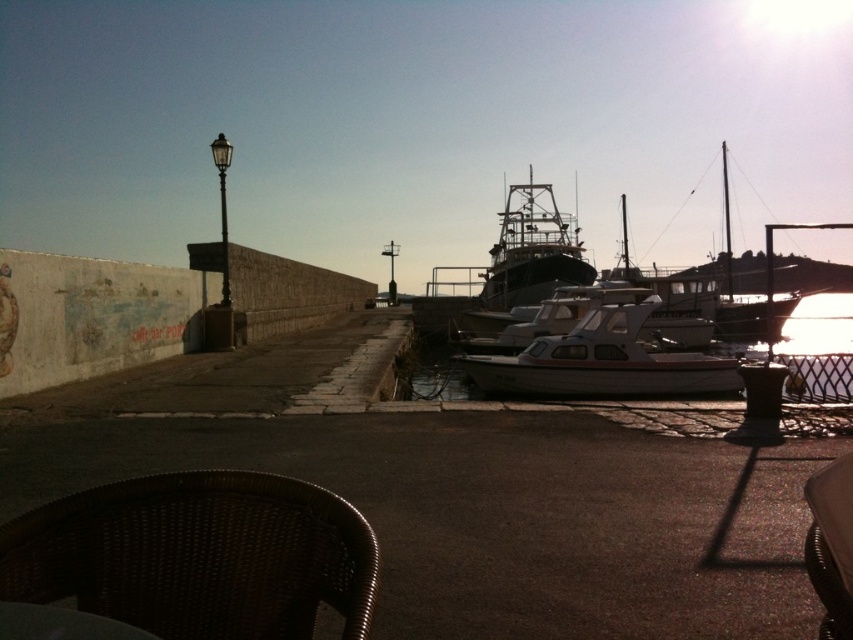
You are standing at the center of the walkway in the harbor scene. You want to place a small potted plant exactly at the center of the walkway. The brown woven chair at lower left is located at coordinates 0.869, 0.233. Can you determine if the potted plant will be closer to the chair or the streetlamp?

The brown woven chair at lower left is located at coordinates (x=198, y=556). Since the potted plant is placed at the center of the walkway, which is equidistant from both ends, the distance to the chair and the streetlamp would depend on their positions. However, without knowing the exact coordinates of the streetlamp, it is impossible to determine which is closer.